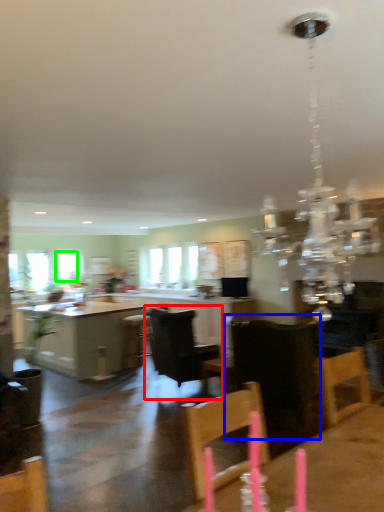
Question: Which object is the farthest from chair (highlighted by a red box)? Choose among these: chair (highlighted by a blue box) or window (highlighted by a green box).

Choices:
 (A) chair
 (B) window

Answer: (B)